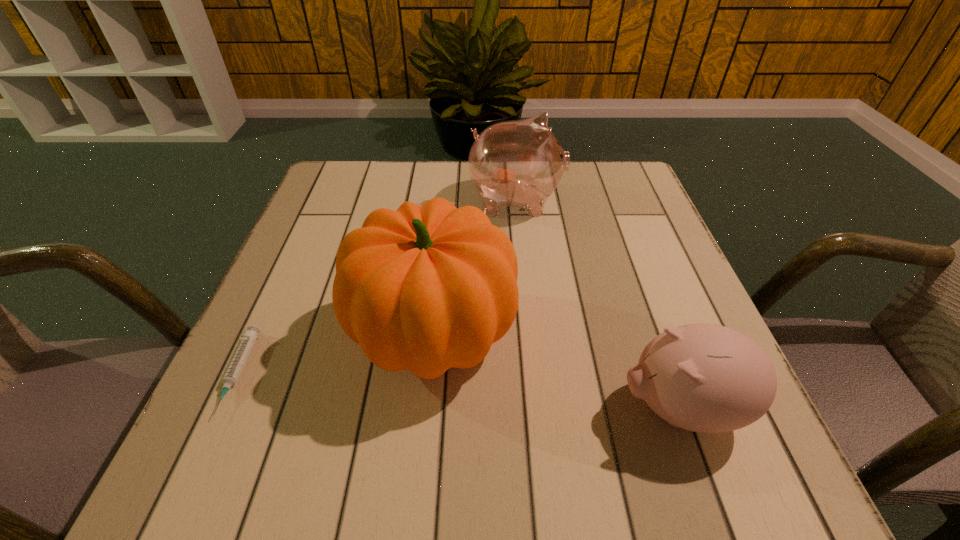
Identify the location of pumpkin. (425, 288).

Where is `the farthest object`? Image resolution: width=960 pixels, height=540 pixels. the farthest object is located at coordinates (519, 163).

Where is `the farther piggy bank`? This screenshot has height=540, width=960. the farther piggy bank is located at coordinates (519, 163).

Locate an element on the screen. the nearer piggy bank is located at coordinates (707, 378).

Identify the location of the right piggy bank. The width and height of the screenshot is (960, 540). (707, 378).

Identify the location of the shortest object. (234, 370).

In order to click on the leftmost object in this screenshot , I will do `click(234, 370)`.

At what (x,y) coordinates should I click in order to perform the action: click on vacant space located on the right of the tallest object. Please return your answer as a coordinate pair (x, y). This screenshot has width=960, height=540. Looking at the image, I should click on (592, 334).

At what (x,y) coordinates should I click in order to perform the action: click on vacant position located 0.060m on the front facing side of the second tallest object. Please return your answer as a coordinate pair (x, y). Looking at the image, I should click on (588, 200).

Where is `free point located at the snout of the nearer piggy bank`? This screenshot has height=540, width=960. free point located at the snout of the nearer piggy bank is located at coordinates (457, 408).